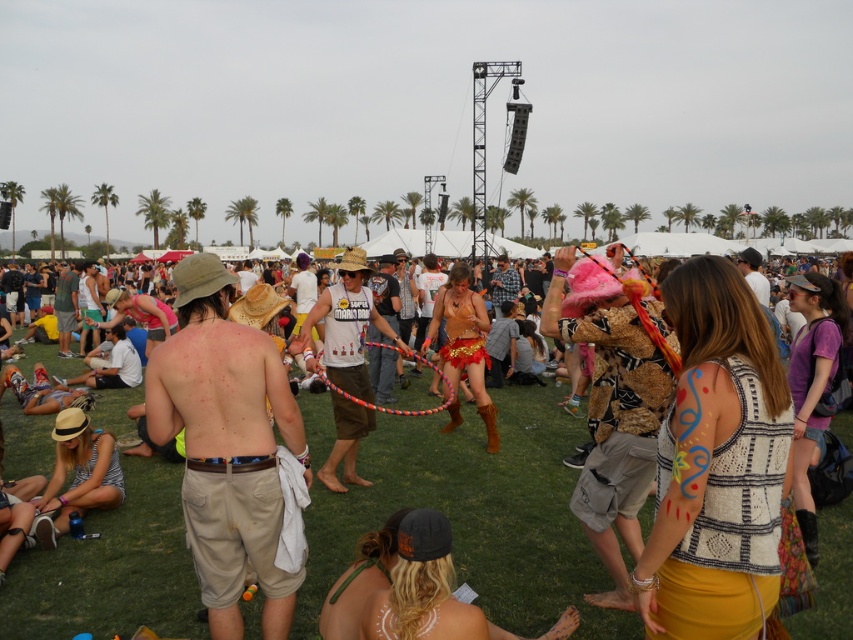
You are at the festival and want to take a photo of both the white printed tank top at center and the checkered fabric shirt at center. Which one should you focus on first to ensure both are in focus?

A: You should focus on the white printed tank top at center first because it is closer to you than the checkered fabric shirt at center, so adjusting focus from near to far will help both be in focus.

You are a photographer at the festival and want to capture a candid shot of the person wearing both the tan cotton shorts at center and the checkered fabric shirt at center. Since you can only focus on one clothing item at a time, which item should you focus on to ensure the other is in the background?

The tan cotton shorts at center is located below the checkered fabric shirt at center, so focusing on the checkered fabric shirt at center will keep the tan cotton shorts at center in the background.